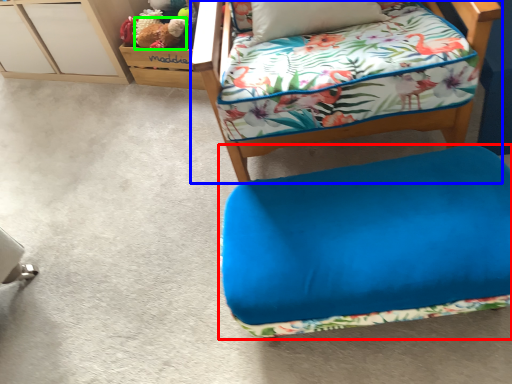
Question: Based on their relative distances, which object is nearer to furniture (highlighted by a red box)? Choose from furniture (highlighted by a blue box) and animal (highlighted by a green box).

Choices:
 (A) furniture
 (B) animal

Answer: (A)